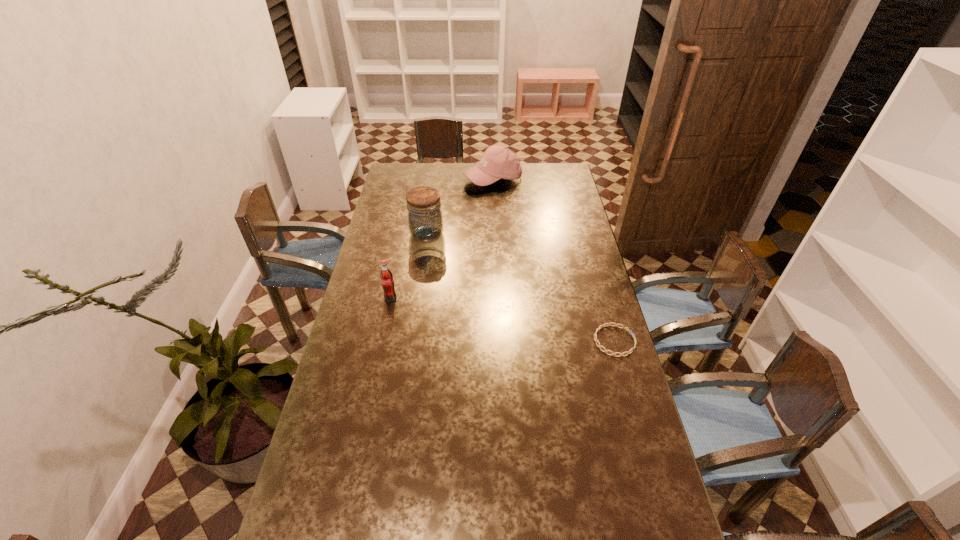
Find the location of a particular element. Image resolution: width=960 pixels, height=540 pixels. vacant space located on the lid of the second farthest object is located at coordinates pyautogui.click(x=465, y=281).

Locate an element on the screen. The image size is (960, 540). vacant space situated 0.180m on the lid of the second farthest object is located at coordinates (455, 269).

At what (x,y) coordinates should I click in order to perform the action: click on free location located 0.280m on the front-facing side of the farthest object. Please return your answer as a coordinate pair (x, y). Looking at the image, I should click on (490, 227).

Identify the location of vacant space located 0.070m on the front-facing side of the farthest object. The image size is (960, 540). (491, 200).

In order to click on free space located on the front-facing side of the farthest object in this screenshot , I will do `click(490, 219)`.

Find the location of a particular element. The height and width of the screenshot is (540, 960). object that is at the far edge is located at coordinates pos(498,162).

The height and width of the screenshot is (540, 960). I want to click on soda bottle that is at the left edge, so click(x=386, y=276).

This screenshot has height=540, width=960. Identify the location of jar that is at the left edge. (425, 220).

Locate an element on the screen. This screenshot has height=540, width=960. object situated at the right edge is located at coordinates (608, 324).

Identify the location of free point at the near edge. (447, 537).